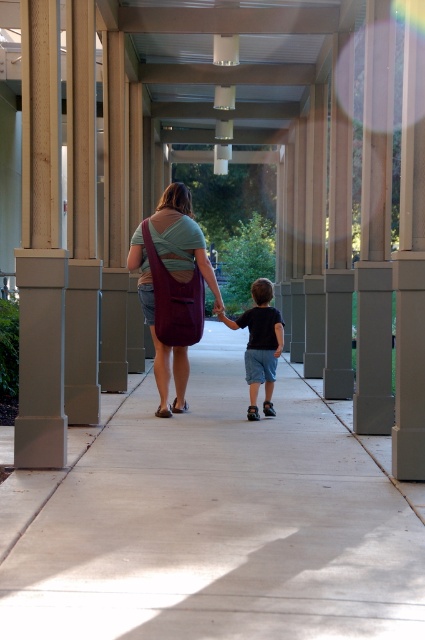
Question: Does smooth gray pillar at left appear on the right side of matte purple bag at center?

Choices:
 (A) yes
 (B) no

Answer: (B)

Question: Which object is positioned closest to the matte purple bag at center?

Choices:
 (A) smooth gray pillar at left
 (B) dark blue cotton shorts at center

Answer: (B)

Question: Estimate the real-world distances between objects in this image. Which object is closer to the dark blue cotton shorts at center?

Choices:
 (A) smooth gray pillar at left
 (B) matte purple bag at center

Answer: (B)

Question: Does smooth gray pillar at left appear over matte purple bag at center?

Choices:
 (A) yes
 (B) no

Answer: (A)

Question: Is the position of matte purple bag at center more distant than that of dark blue cotton shorts at center?

Choices:
 (A) yes
 (B) no

Answer: (B)

Question: Which point appears farthest from the camera in this image?

Choices:
 (A) (167, 410)
 (B) (266, 374)

Answer: (B)